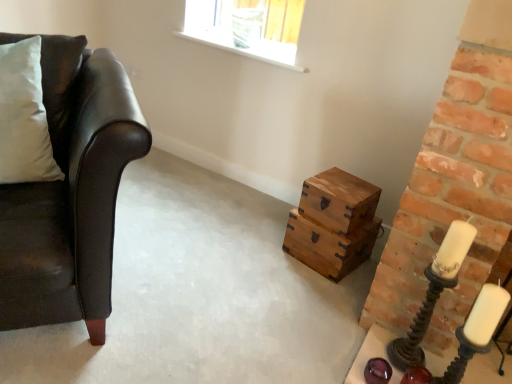
I want to click on blank area to the left of metallic spiral candle holder at right, which is the 1th candle holder in left-to-right order, so click(371, 349).